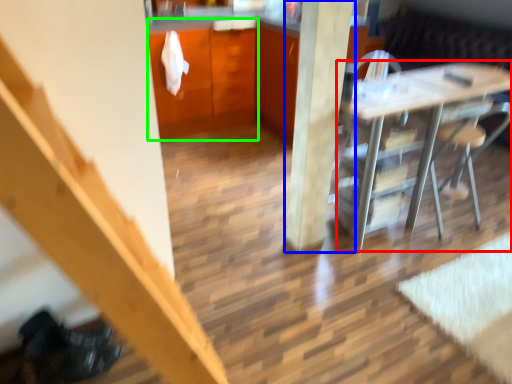
Question: Considering the real-world distances, which object is closest to desk (highlighted by a red box)? pillar (highlighted by a blue box) or dresser (highlighted by a green box).

Choices:
 (A) pillar
 (B) dresser

Answer: (A)